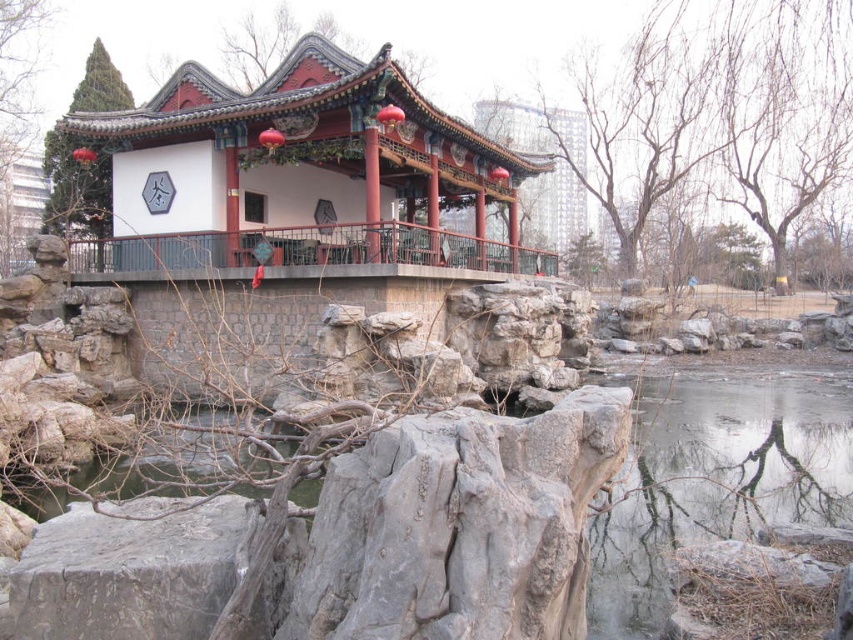
Is matte red gazebo at center positioned before rustic wood balcony at center?

No, it is not.

Is matte red gazebo at center wider than rustic wood balcony at center?

Indeed, matte red gazebo at center has a greater width compared to rustic wood balcony at center.

The width and height of the screenshot is (853, 640). What do you see at coordinates (300, 170) in the screenshot?
I see `matte red gazebo at center` at bounding box center [300, 170].

Locate an element on the screen. matte red gazebo at center is located at coordinates (300, 170).